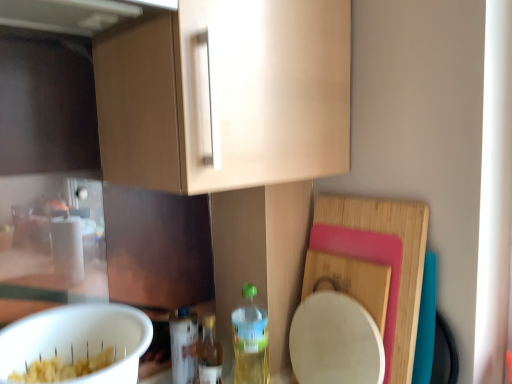
Question: Could you tell me if translucent plastic bottle at lower center, arranged as the 1th bottle when viewed from the left, is turned towards translucent plastic bottle at lower center, which is the 1th bottle from right to left?

Choices:
 (A) no
 (B) yes

Answer: (A)

Question: Does translucent plastic bottle at lower center, arranged as the 1th bottle when viewed from the left, have a lesser height compared to translucent plastic bottle at lower center, the third bottle when ordered from left to right?

Choices:
 (A) no
 (B) yes

Answer: (B)

Question: Is translucent plastic bottle at lower center, arranged as the 1th bottle when viewed from the left, far from translucent plastic bottle at lower center, the third bottle when ordered from left to right?

Choices:
 (A) yes
 (B) no

Answer: (B)

Question: From the image's perspective, is translucent plastic bottle at lower center, the third bottle in the right-to-left sequence, located beneath translucent plastic bottle at lower center, which is the 1th bottle from right to left?

Choices:
 (A) no
 (B) yes

Answer: (B)

Question: Does translucent plastic bottle at lower center, arranged as the 1th bottle when viewed from the left, have a larger size compared to translucent plastic bottle at lower center, the third bottle when ordered from left to right?

Choices:
 (A) yes
 (B) no

Answer: (B)

Question: Is translucent plastic bottle at lower center, the third bottle in the right-to-left sequence, facing away from translucent plastic bottle at lower center, the third bottle when ordered from left to right?

Choices:
 (A) no
 (B) yes

Answer: (A)

Question: Can you confirm if translucent plastic bottle at lower center, marked as the second bottle in a left-to-right arrangement, is positioned to the right of white matte mixing bowl at lower left?

Choices:
 (A) no
 (B) yes

Answer: (B)

Question: Can you confirm if translucent plastic bottle at lower center, marked as the second bottle in a left-to-right arrangement, is wider than white matte mixing bowl at lower left?

Choices:
 (A) yes
 (B) no

Answer: (B)

Question: Considering the relative sizes of translucent plastic bottle at lower center, marked as the second bottle in a left-to-right arrangement, and white matte mixing bowl at lower left in the image provided, is translucent plastic bottle at lower center, marked as the second bottle in a left-to-right arrangement, thinner than white matte mixing bowl at lower left?

Choices:
 (A) no
 (B) yes

Answer: (B)

Question: From the image's perspective, is translucent plastic bottle at lower center, marked as the second bottle in a left-to-right arrangement, under white matte mixing bowl at lower left?

Choices:
 (A) no
 (B) yes

Answer: (B)

Question: Does translucent plastic bottle at lower center, the 2th bottle viewed from the right, have a smaller size compared to white matte mixing bowl at lower left?

Choices:
 (A) no
 (B) yes

Answer: (B)

Question: Is translucent plastic bottle at lower center, the third bottle in the right-to-left sequence, next to translucent plastic bottle at lower center, the 2th bottle viewed from the right?

Choices:
 (A) yes
 (B) no

Answer: (A)